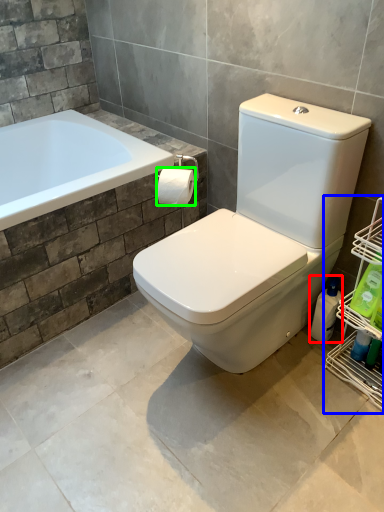
Question: Which object is the closest to the cleaning product (highlighted by a red box)? Choose among these: shelf (highlighted by a blue box) or toilet paper (highlighted by a green box).

Choices:
 (A) shelf
 (B) toilet paper

Answer: (A)